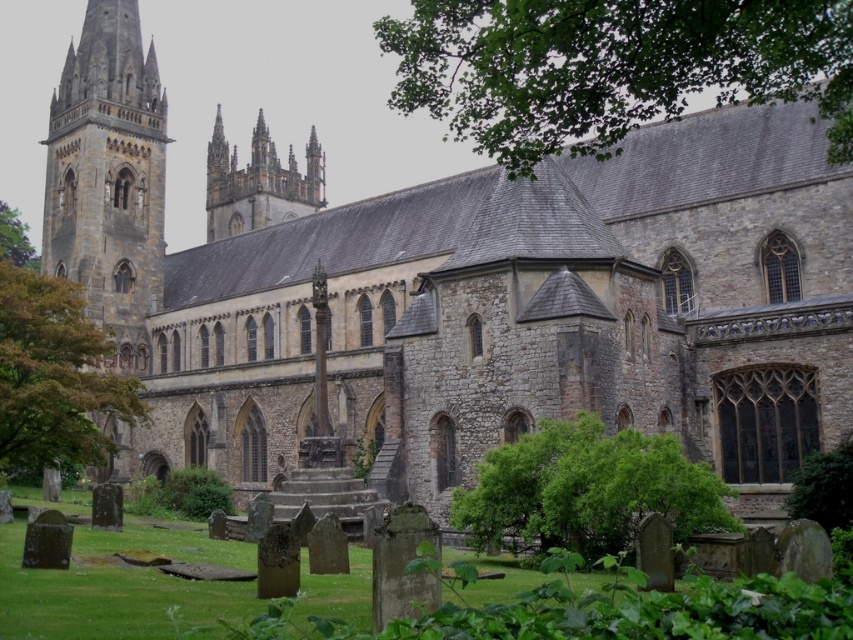
Does stone tower at left appear on the right side of green leafy tree at center?

Incorrect, stone tower at left is not on the right side of green leafy tree at center.

The height and width of the screenshot is (640, 853). In order to click on stone tower at left in this screenshot , I will do `click(108, 177)`.

Identify the location of stone tower at left. Image resolution: width=853 pixels, height=640 pixels. (108, 177).

Can you confirm if green leafy tree at center is positioned to the left of stone gothic spires at upper center?

No, green leafy tree at center is not to the left of stone gothic spires at upper center.

Who is more forward, (608,486) or (248,163)?

Point (608,486) is more forward.

What are the coordinates of `green leafy tree at center` in the screenshot? It's located at [x=587, y=490].

At what (x,y) coordinates should I click in order to perform the action: click on green leafy tree at center. Please return your answer as a coordinate pair (x, y). This screenshot has height=640, width=853. Looking at the image, I should click on (587, 490).

Is point (13, 384) positioned after point (4, 209)?

No, it is in front of (4, 209).

Which of these two, green leafy tree at left or green leafy tree at upper left, stands shorter?

Standing shorter between the two is green leafy tree at upper left.

Which is in front, point (51, 358) or point (16, 253)?

Point (51, 358) is more forward.

Locate an element on the screen. The image size is (853, 640). green leafy tree at left is located at coordinates (54, 376).